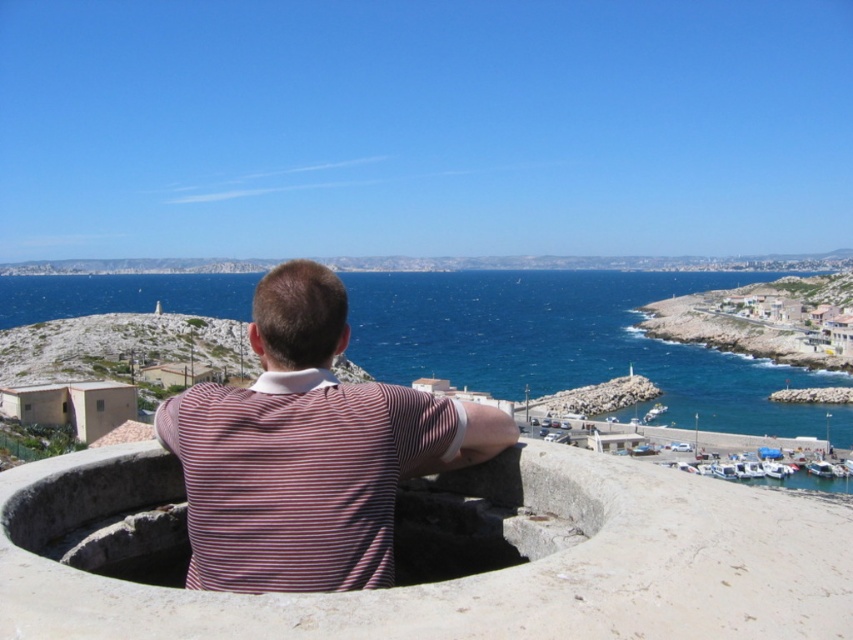
What are the coordinates of `striped cotton shirt at center` in the screenshot? It's located at (308, 451).

Between striped cotton shirt at center and blue water at center, which one is positioned lower?

striped cotton shirt at center is below.

Locate an element on the screen. The image size is (853, 640). striped cotton shirt at center is located at coordinates 308,451.